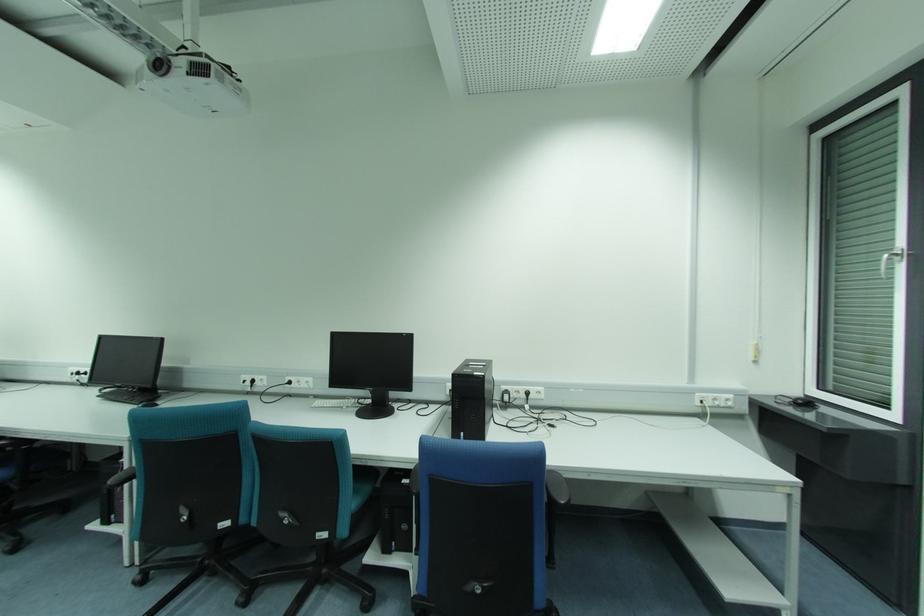
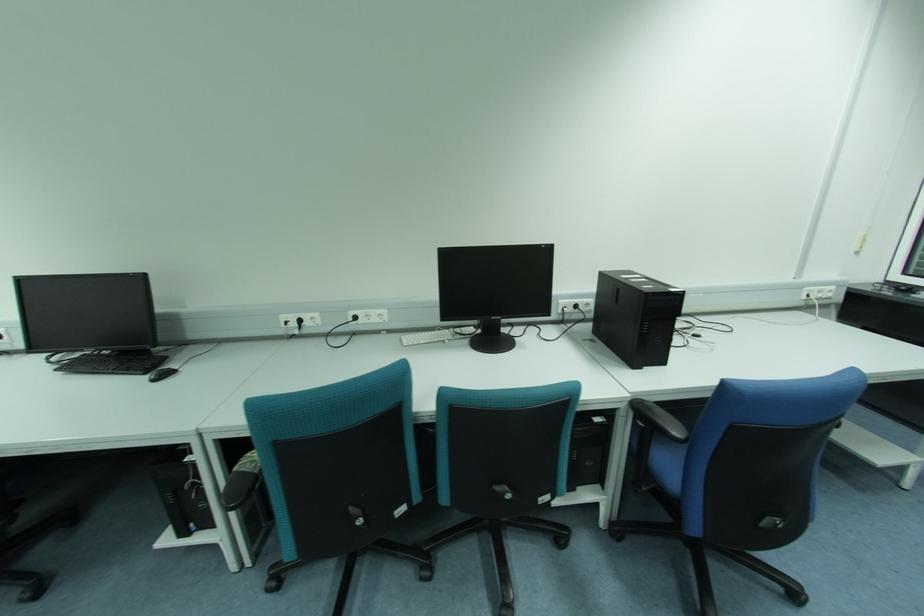
In the second image, find the point that corresponds to the point at 304,379 in the first image.

(374, 313)